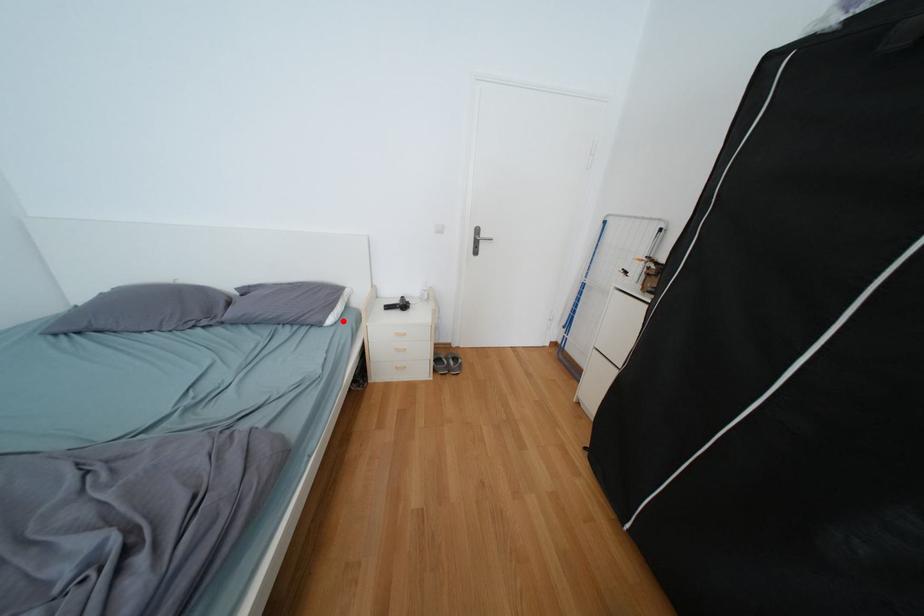
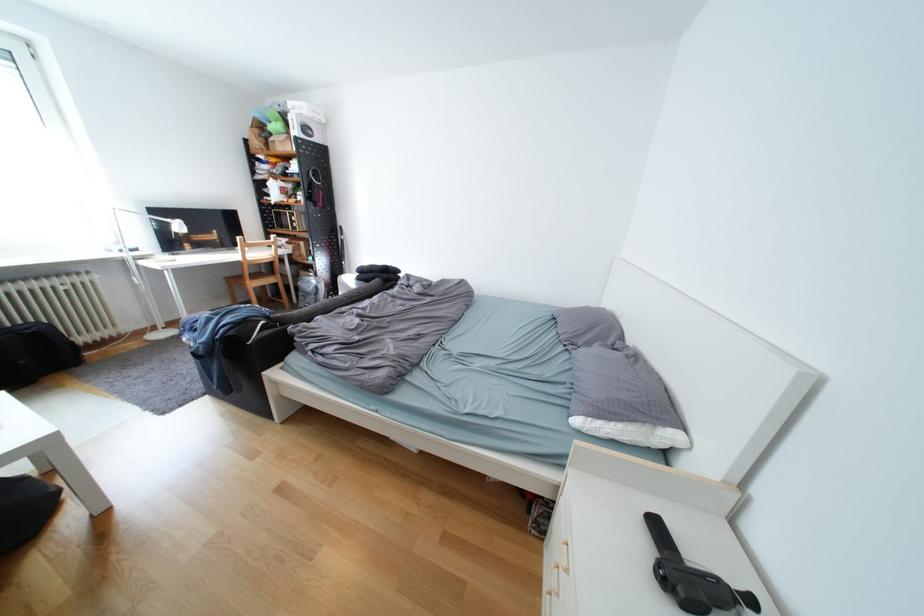
In the second image, find the point that corresponds to the highlighted location in the first image.

(590, 422)